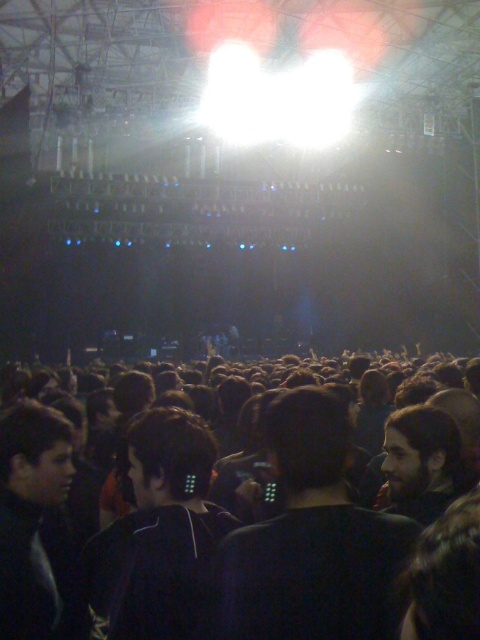
Question: Does black matte earbuds at center appear under dark brown hair at center?

Choices:
 (A) yes
 (B) no

Answer: (A)

Question: Which object is farther from the camera taking this photo?

Choices:
 (A) dark brown hair at center
 (B) black matte phone at center

Answer: (A)

Question: Which point appears closest to the camera in this image?

Choices:
 (A) (50, 435)
 (B) (200, 588)

Answer: (B)

Question: Does black fabric crowd at center have a lesser width compared to black matte hair at center?

Choices:
 (A) yes
 (B) no

Answer: (B)

Question: Which of these objects is positioned farthest from the black matte hair at center?

Choices:
 (A) dark brown hair at center
 (B) black matte earbuds at center
 (C) black fabric crowd at center

Answer: (A)

Question: Is black fabric crowd at center below black matte earbuds at center?

Choices:
 (A) yes
 (B) no

Answer: (B)